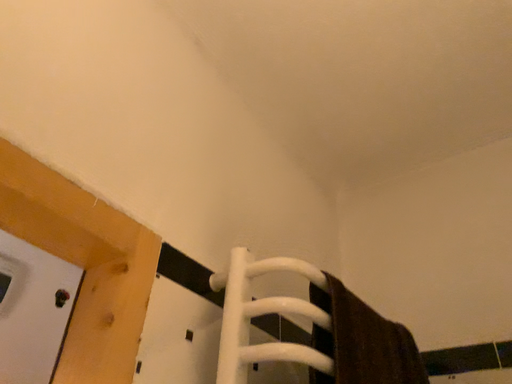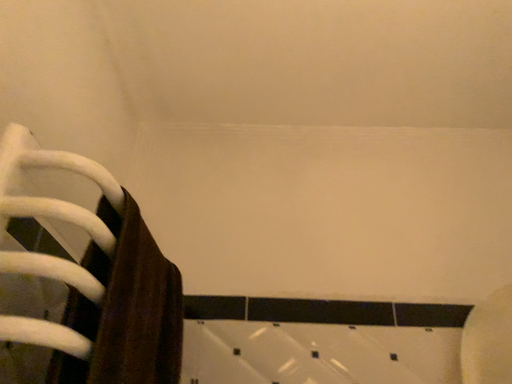
Question: How did the camera likely rotate when shooting the video?

Choices:
 (A) rotated left
 (B) rotated right

Answer: (B)